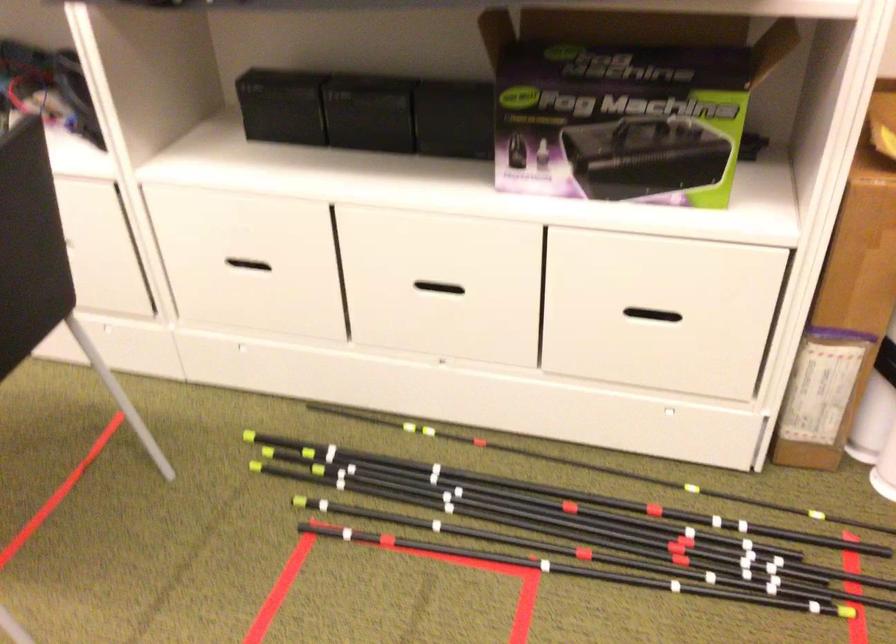
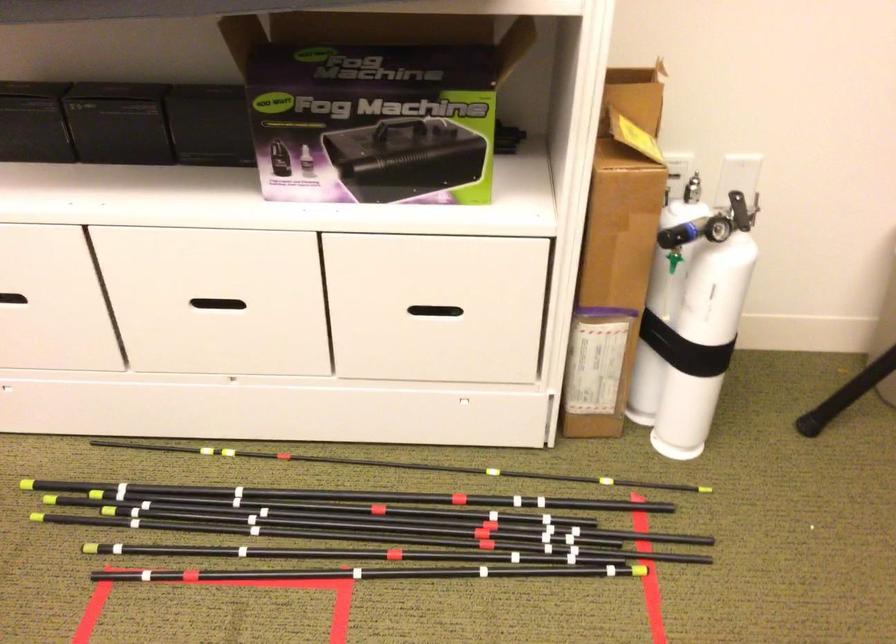
Question: How did the camera likely rotate?

Choices:
 (A) Left
 (B) Right
 (C) Up
 (D) Down

Answer: (B)